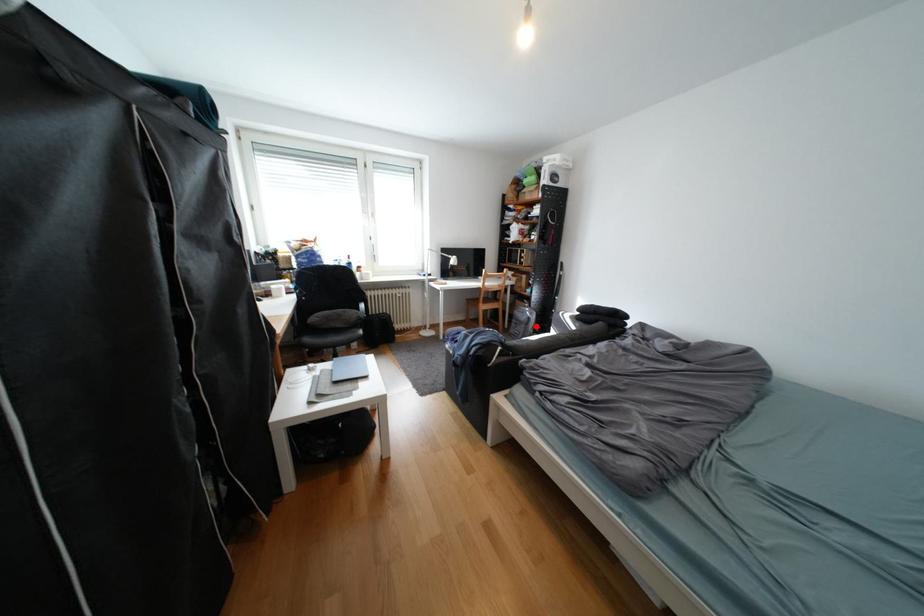
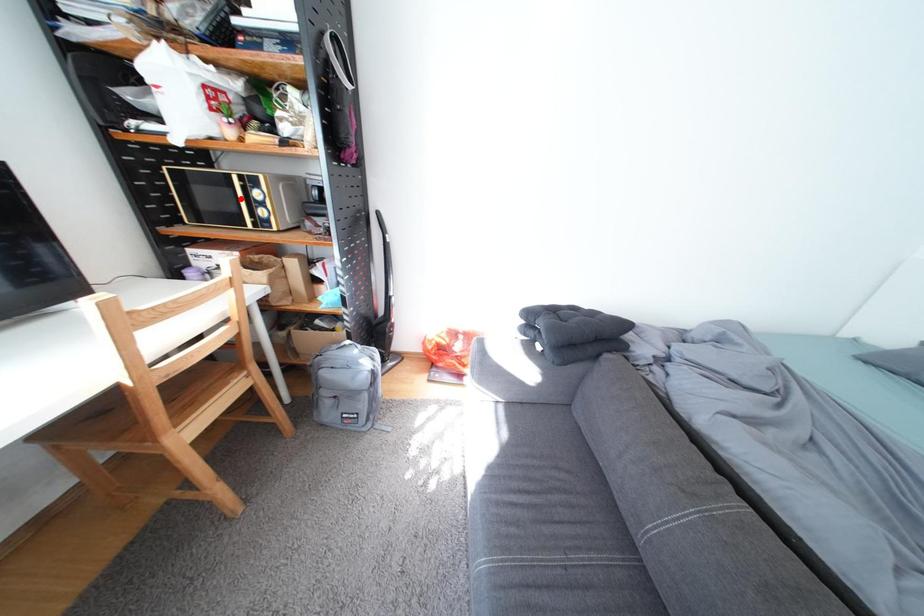
I am providing you with two images of the same scene from different viewpoints. A red point is marked on the first image and another point is marked on the second image. Does the point marked in image1 correspond to the same location as the one in image2?

No